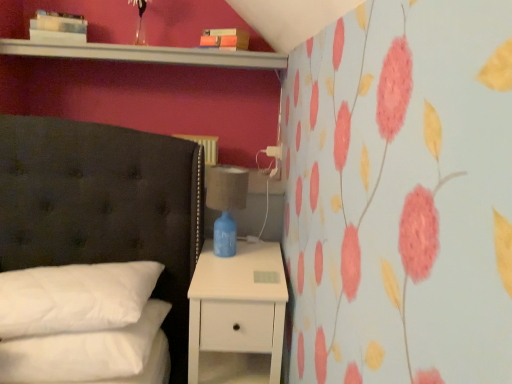
Question: In the image, is white soft pillow at lower left, acting as the first pillow starting from the bottom, positioned in front of or behind blue ceramic lamp at right?

Choices:
 (A) front
 (B) behind

Answer: (A)

Question: Considering the positions of point (159, 317) and point (211, 185), is point (159, 317) closer or farther from the camera than point (211, 185)?

Choices:
 (A) closer
 (B) farther

Answer: (A)

Question: Which object is the farthest from the white glossy shelf at upper center?

Choices:
 (A) white matte nightstand at lower right
 (B) white soft pillow at lower left, acting as the first pillow starting from the bottom
 (C) blue ceramic lamp at right
 (D) white soft pillow at lower left, placed as the first pillow when sorted from top to bottom

Answer: (B)

Question: Which of these objects is positioned farthest from the white soft pillow at lower left, acting as the first pillow starting from the bottom?

Choices:
 (A) white matte nightstand at lower right
 (B) blue ceramic lamp at right
 (C) white soft pillow at lower left, acting as the second pillow starting from the bottom
 (D) white glossy shelf at upper center

Answer: (D)